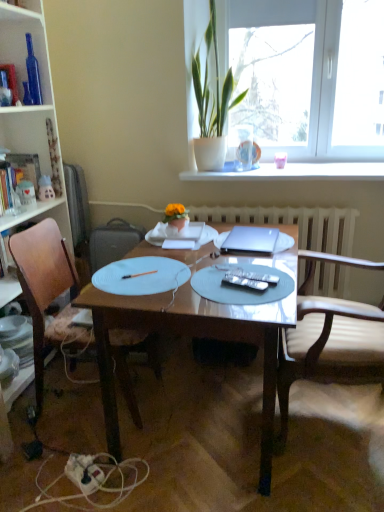
Where is `vacant space behind silver metallic remote control at center`? The width and height of the screenshot is (384, 512). vacant space behind silver metallic remote control at center is located at coordinates (238, 268).